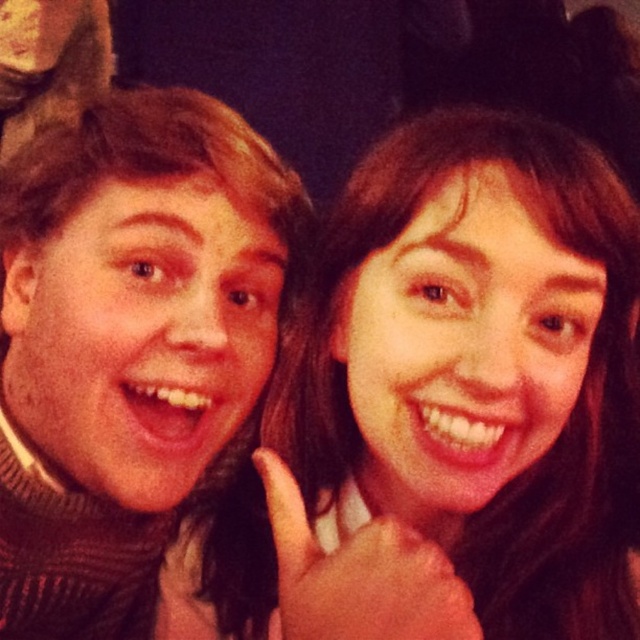
Question: Is matte brown sweater at left to the left of smooth skin hand at center from the viewer's perspective?

Choices:
 (A) no
 (B) yes

Answer: (B)

Question: Is smooth skin face at center bigger than matte brown sweater at left?

Choices:
 (A) no
 (B) yes

Answer: (B)

Question: Which point is closer to the camera?

Choices:
 (A) (435, 113)
 (B) (177, 358)
 (C) (428, 554)

Answer: (C)

Question: Which object is the farthest from the smooth skin face at center?

Choices:
 (A) matte brown sweater at left
 (B) smooth skin hand at center

Answer: (A)

Question: Among these objects, which one is nearest to the camera?

Choices:
 (A) smooth skin hand at center
 (B) smooth skin face at center
 (C) matte brown sweater at left

Answer: (A)

Question: Does smooth skin face at center appear on the left side of matte brown sweater at left?

Choices:
 (A) yes
 (B) no

Answer: (B)